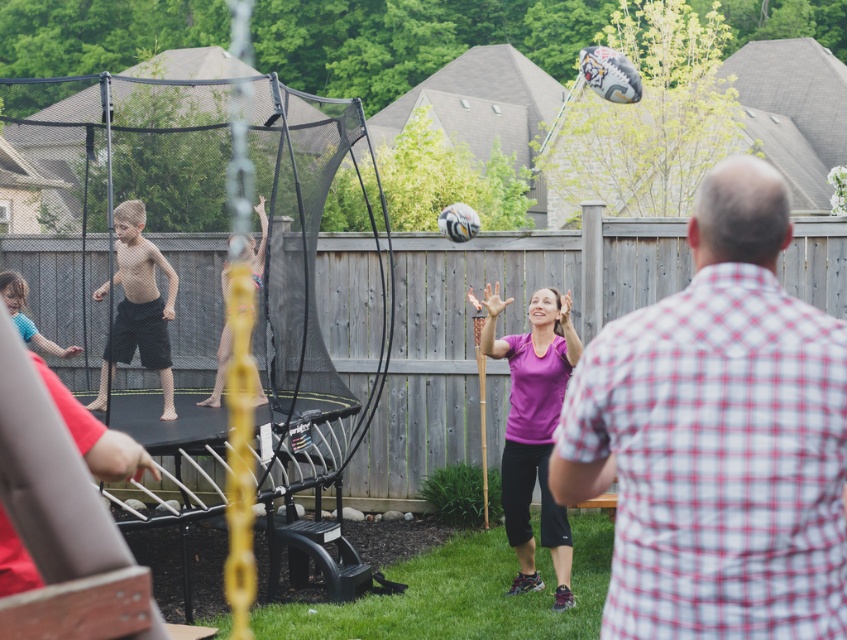
Who is more distant from viewer, (654, 467) or (560, 356)?

Positioned behind is point (560, 356).

What are the coordinates of `plaid cotton shirt at center` in the screenshot? It's located at (718, 436).

Can you confirm if plaid cotton shirt at center is shorter than pink fabric shorts at center?

No.

Measure the distance between point (728, 577) and camera.

Point (728, 577) is 3.89 meters away from camera.

Identify the location of plaid cotton shirt at center. (718, 436).

I want to click on plaid cotton shirt at center, so click(718, 436).

Between black matte shorts at center and pink fabric shorts at center, which one appears on the right side from the viewer's perspective?

From the viewer's perspective, pink fabric shorts at center appears more on the right side.

Who is lower down, black matte shorts at center or pink fabric shorts at center?

black matte shorts at center is lower down.

Is point (114, 358) in front of point (259, 259)?

No.

At what (x,y) coordinates should I click in order to perform the action: click on black matte shorts at center. Please return your answer as a coordinate pair (x, y). The height and width of the screenshot is (640, 847). Looking at the image, I should click on (137, 307).